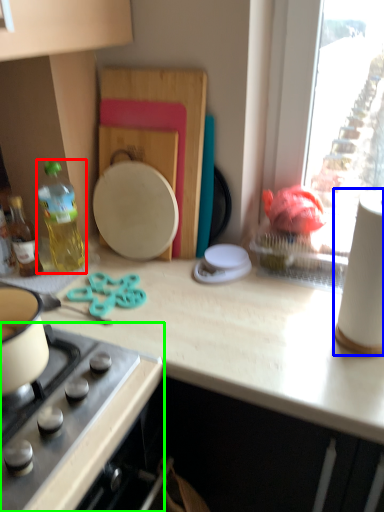
Question: Which object is positioned farthest from bottle (highlighted by a red box)? Select from paper towel (highlighted by a blue box) and gas stove (highlighted by a green box).

Choices:
 (A) paper towel
 (B) gas stove

Answer: (A)